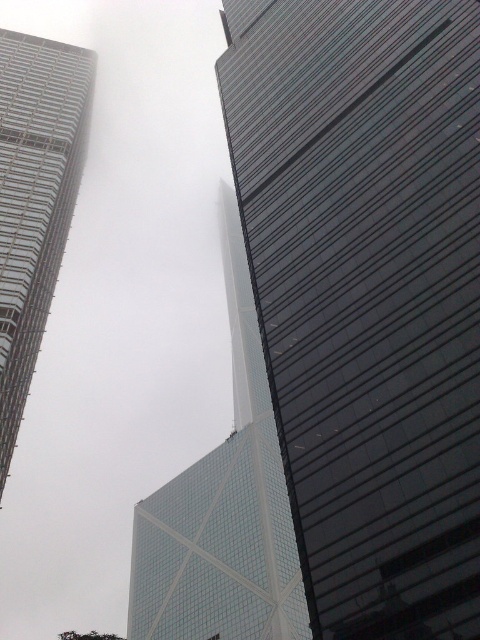
In order to click on glassy reflective skyscraper at right in this screenshot , I will do `click(367, 294)`.

How far apart are glassy reflective skyscraper at right and glassy steel skyscraper at left?

glassy reflective skyscraper at right is 20.27 meters from glassy steel skyscraper at left.

Looking at this image, measure the distance between point (332, 436) and camera.

A distance of 111.11 feet exists between point (332, 436) and camera.

You are a GUI agent. You are given a task and a screenshot of the screen. Output one action in this format:
    pyautogui.click(x=<x>, y=<y>)
    Task: Click on the glassy reflective skyscraper at right
    Image resolution: width=480 pixels, height=640 pixels.
    Given the screenshot: What is the action you would take?
    pyautogui.click(x=367, y=294)

Can you confirm if glassy reflective skyscraper at right is positioned to the right of transparent glass tower at center?

Correct, you'll find glassy reflective skyscraper at right to the right of transparent glass tower at center.

Who is more forward, (330, 300) or (283, 596)?

Positioned in front is point (330, 300).

Does point (383, 600) lie behind point (230, 317)?

No, (383, 600) is closer to viewer.

The image size is (480, 640). I want to click on glassy reflective skyscraper at right, so pos(367,294).

Looking at this image, who is positioned more to the left, transparent glass tower at center or glassy steel skyscraper at left?

From the viewer's perspective, glassy steel skyscraper at left appears more on the left side.

Which is in front, point (241, 593) or point (44, 168)?

Point (44, 168) is in front.

What do you see at coordinates (223, 508) in the screenshot? The height and width of the screenshot is (640, 480). I see `transparent glass tower at center` at bounding box center [223, 508].

This screenshot has height=640, width=480. In order to click on transparent glass tower at center in this screenshot , I will do `click(223, 508)`.